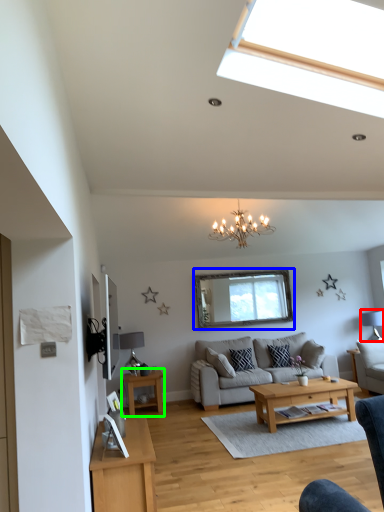
Question: Based on their relative distances, which object is nearer to lamp (highlighted by a red box)? Choose from window screen (highlighted by a blue box) and table (highlighted by a green box).

Choices:
 (A) window screen
 (B) table

Answer: (A)